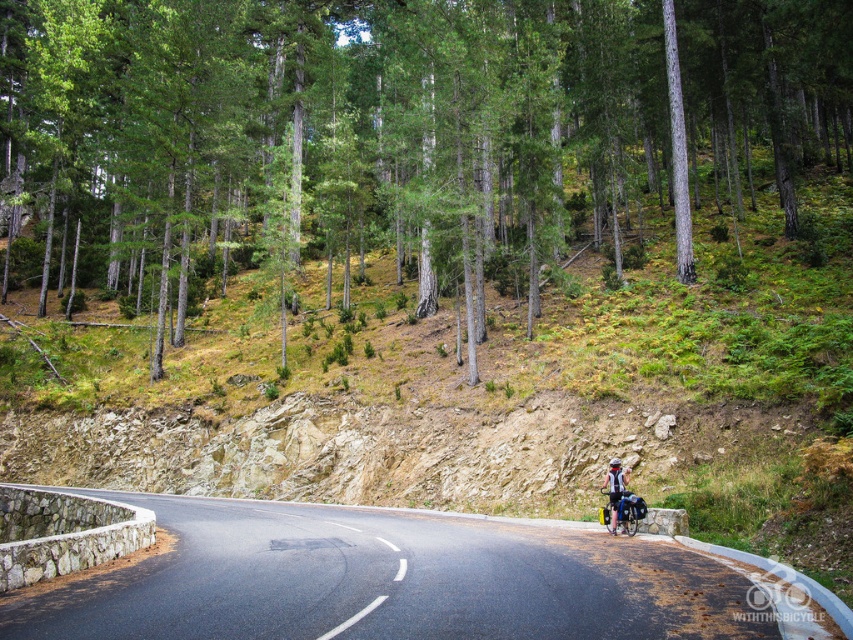
Between silver metallic bicycle at center and light blue fabric backpack at center, which one appears on the left side from the viewer's perspective?

silver metallic bicycle at center is more to the left.

Is point (611, 500) positioned in front of point (618, 502)?

No, it is behind (618, 502).

Identify the location of silver metallic bicycle at center. The width and height of the screenshot is (853, 640). (624, 512).

Is point (415, 35) behind point (628, 492)?

That is True.

Who is taller, green/smooth tree at center or silver metallic bicycle at center?

Standing taller between the two is green/smooth tree at center.

Between point (567, 140) and point (622, 500), which one is positioned behind?

The point (567, 140) is behind.

Find the location of `green/smooth tree at center`. green/smooth tree at center is located at coordinates (402, 131).

Does green/smooth tree at center appear on the right side of black asphalt road at center?

In fact, green/smooth tree at center is to the left of black asphalt road at center.

Is green/smooth tree at center bigger than black asphalt road at center?

Yes, green/smooth tree at center is bigger than black asphalt road at center.

Describe the element at coordinates (402, 131) in the screenshot. I see `green/smooth tree at center` at that location.

At what (x,y) coordinates should I click in order to perform the action: click on green/smooth tree at center. Please return your answer as a coordinate pair (x, y). This screenshot has height=640, width=853. Looking at the image, I should click on (402, 131).